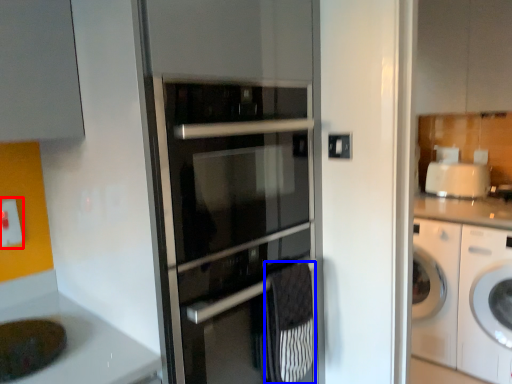
Question: Which object is closer to the camera taking this photo, electric outlet (highlighted by a red box) or material (highlighted by a blue box)?

Choices:
 (A) electric outlet
 (B) material

Answer: (B)